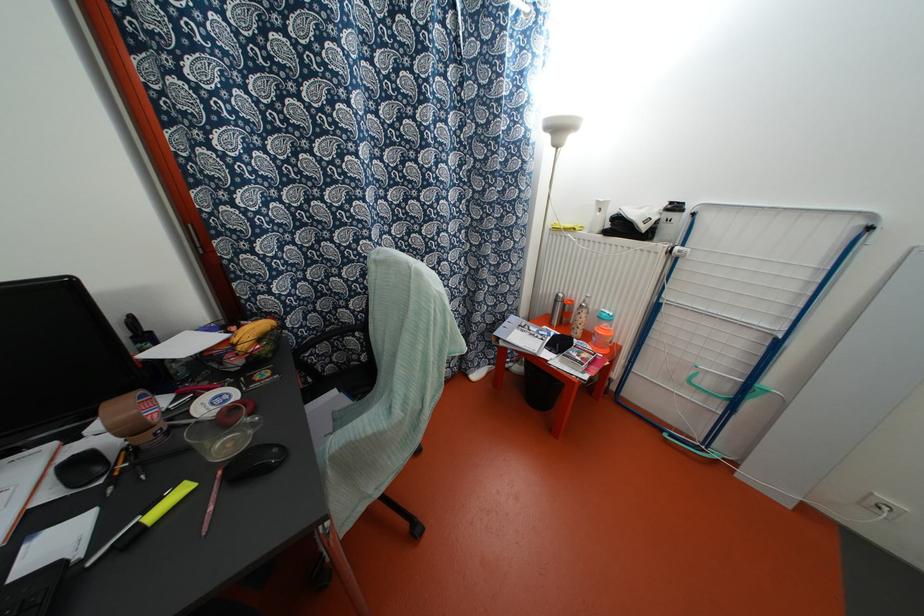
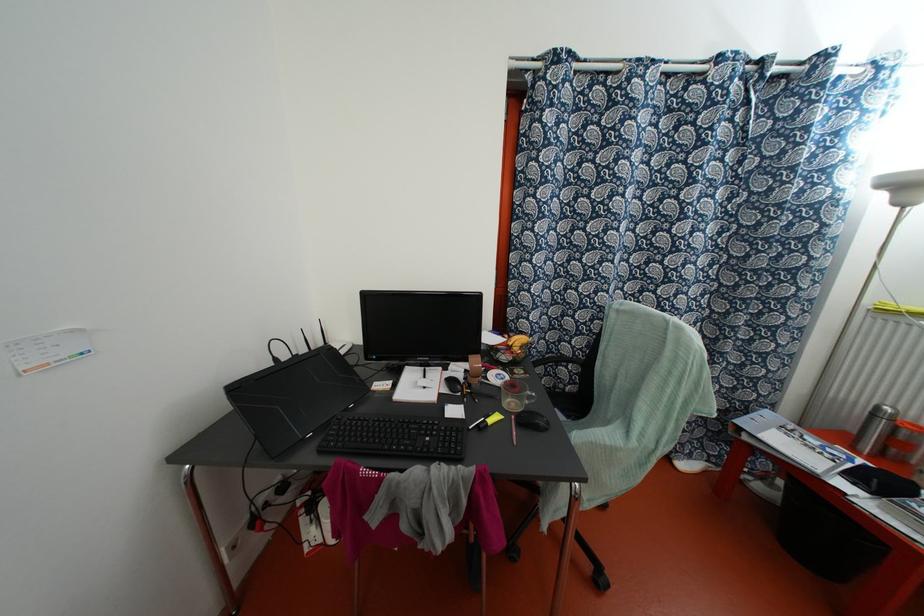
Where in the second image is the point corresponding to point (219, 472) from the first image?

(513, 416)